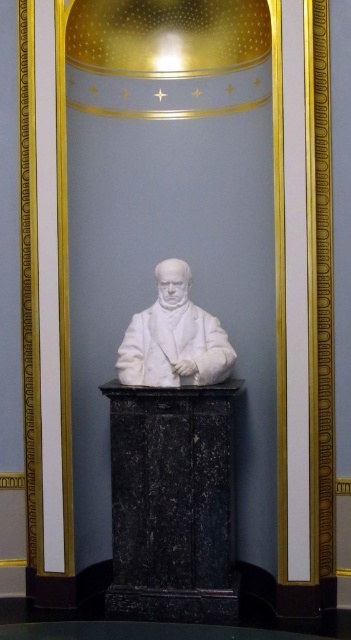
You are an art conservator standing 1 meter away from the black marble pedestal at center. You need to reach a cleaning solution bottle placed 5 meters behind you. Can you safely move from your current position to retrieve the bottle without stepping into the niche where the bust is displayed?

The distance between you and the black marble pedestal at center is 4.34 meters. Since you are currently 1 meter away from it, you are within the 4.34 meters distance. The cleaning solution bottle is 5 meters behind you, so moving to retrieve it would require stepping beyond the 4.34 meters distance, which is safe as it would take you outside the niche area. Therefore, you can safely move to get the bottle without entering the niche.

Looking at this image, you are an art curator planning to move the black marble pedestal at center and the white marble bust at center to a new exhibition space. The entrance of the new space has a doorway that is 1.2 meters wide. Can both objects be moved through the doorway without rotating them? Please explain your reasoning.

The black marble pedestal at center is wider than the white marble bust at center. Since the doorway is 1.2 meters wide, the pedestal may not fit if its width exceeds 1.2 meters. However, the bust might fit as it is narrower. Without specific measurements, it is uncertain if both can pass. The description only states the pedestal is wider than the bust, but not their exact dimensions.